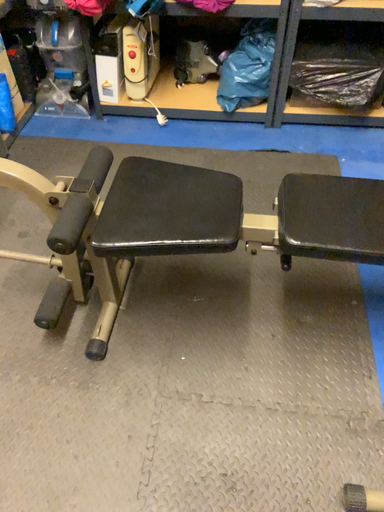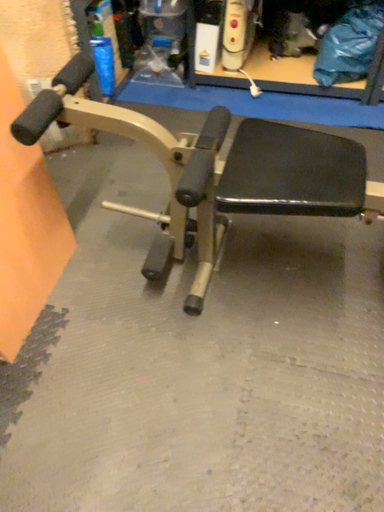
Question: Which way did the camera rotate in the video?

Choices:
 (A) rotated left
 (B) rotated right

Answer: (A)